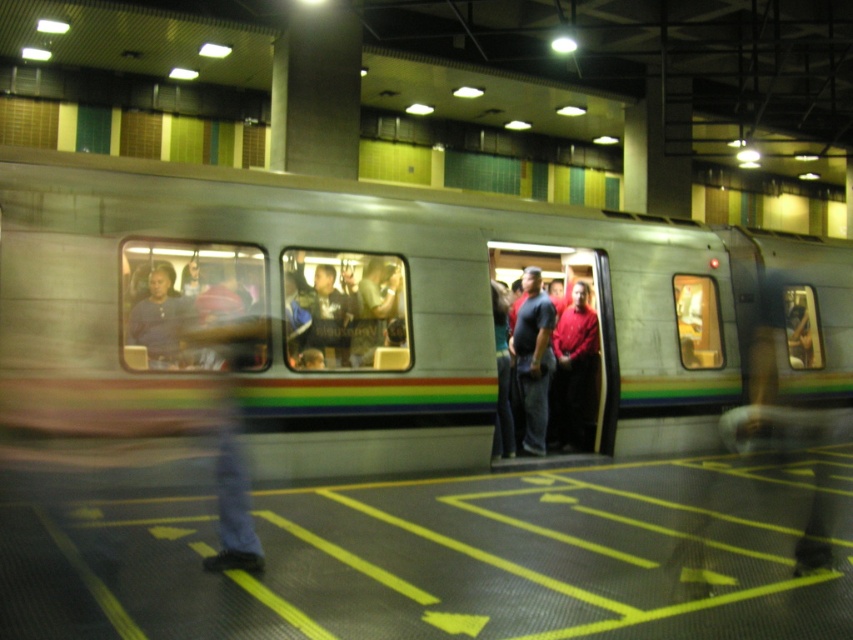
Question: Is metallic silver train at center positioned in front of matte black shirt at left?

Choices:
 (A) yes
 (B) no

Answer: (A)

Question: Can you confirm if matte black shirt at left is thinner than matte blue shirt at left?

Choices:
 (A) yes
 (B) no

Answer: (B)

Question: Which object is the closest to the metallic silver train at center?

Choices:
 (A) matte black shirt at left
 (B) red shirt at center
 (C) matte blue shirt at left
 (D) dark blue jeans at center

Answer: (A)

Question: Which point is farther to the camera?

Choices:
 (A) matte black shirt at left
 (B) dark blue jeans at center
 (C) red shirt at center

Answer: (C)

Question: Among these objects, which one is nearest to the camera?

Choices:
 (A) matte black shirt at left
 (B) metallic silver train at center
 (C) red shirt at center
 (D) dark blue jeans at center

Answer: (B)

Question: Does red shirt at center have a larger size compared to dark blue jeans at center?

Choices:
 (A) yes
 (B) no

Answer: (A)